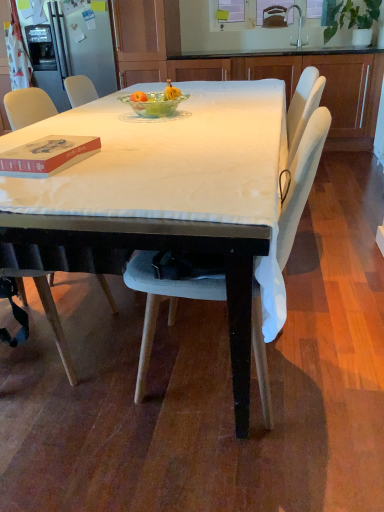
What is the approximate height of translucent glass bowl at center?

translucent glass bowl at center is 4.48 inches in height.

In order to face translucent glass bowl at center, should I rotate leftwards or rightwards?

Rotate left and turn 4.793 degrees.

The height and width of the screenshot is (512, 384). I want to click on translucent glass bowl at center, so click(155, 102).

Does white fabric-covered table at center turn towards matte red book at left?

No, white fabric-covered table at center is not facing towards matte red book at left.

Based on the photo, from the image's perspective, which one is positioned higher, white fabric-covered table at center or matte red book at left?

From the image's view, white fabric-covered table at center is above.

From a real-world perspective, is white fabric-covered table at center located higher than matte red book at left?

Actually, white fabric-covered table at center is physically below matte red book at left in the real world.

Which is more to the left, white fabric-covered table at center or matte red book at left?

Positioned to the left is matte red book at left.

Considering the points (363, 42) and (167, 68), which point is behind, point (363, 42) or point (167, 68)?

Positioned behind is point (167, 68).

Which object is further away from the camera, green leafy plant at upper right or white wood cabinets at center?

white wood cabinets at center is further from the camera.

Visually, is green leafy plant at upper right positioned to the left or to the right of white wood cabinets at center?

green leafy plant at upper right is to the right of white wood cabinets at center.

Are green leafy plant at upper right and white wood cabinets at center located far from each other?

They are positioned close to each other.

Between white fabric-covered table at center and green leafy plant at upper right, which one has larger width?

white fabric-covered table at center is wider.

From the image's perspective, which one is positioned lower, white fabric-covered table at center or green leafy plant at upper right?

white fabric-covered table at center is shown below in the image.

Which point is more forward, (134, 164) or (364, 36)?

Point (134, 164)

Does white fabric-covered table at center have a lesser height compared to green leafy plant at upper right?

Indeed, white fabric-covered table at center has a lesser height compared to green leafy plant at upper right.

Would you consider matte red book at left to be distant from light gray fabric chair at center?

→ matte red book at left is near light gray fabric chair at center, not far away.

In the image, is matte red book at left on the left side or the right side of light gray fabric chair at center?

In the image, matte red book at left appears on the left side of light gray fabric chair at center.

Considering the sizes of objects matte red book at left and light gray fabric chair at center in the image provided, who is shorter, matte red book at left or light gray fabric chair at center?

Standing shorter between the two is matte red book at left.

Can we say matte red book at left lies outside light gray fabric chair at center?

Yes, matte red book at left is outside of light gray fabric chair at center.

Is silver metallic faucet at upper center next to matte red book at left and touching it?

silver metallic faucet at upper center and matte red book at left are clearly separated.

Can you confirm if silver metallic faucet at upper center is taller than matte red book at left?

Correct, silver metallic faucet at upper center is much taller as matte red book at left.

From the image's perspective, which one is positioned lower, silver metallic faucet at upper center or matte red book at left?

matte red book at left.

Based on the photo, which of these two, silver metallic faucet at upper center or matte red book at left, is thinner?

silver metallic faucet at upper center.

Are matte red book at left and silver metallic faucet at upper center beside each other?

No, matte red book at left is not next to silver metallic faucet at upper center.

Measure the distance between matte red book at left and silver metallic faucet at upper center.

matte red book at left is 3.86 meters from silver metallic faucet at upper center.

Is matte red book at left at the left side of silver metallic faucet at upper center?

Correct, you'll find matte red book at left to the left of silver metallic faucet at upper center.

Considering the sizes of matte red book at left and white wood cabinets at center in the image, is matte red book at left wider or thinner than white wood cabinets at center?

Considering their sizes, matte red book at left looks slimmer than white wood cabinets at center.

You are a GUI agent. You are given a task and a screenshot of the screen. Output one action in this format:
    pyautogui.click(x=<x>, y=<y>)
    Task: Click on the cabinetry that is behind the matte red book at left
    This screenshot has height=512, width=384.
    Given the screenshot: What is the action you would take?
    pyautogui.click(x=297, y=82)

How far apart are matte red book at left and white wood cabinets at center?

matte red book at left is 10.08 feet away from white wood cabinets at center.

From a real-world perspective, who is located lower, matte red book at left or white wood cabinets at center?

white wood cabinets at center.

Locate an element on the screen. The height and width of the screenshot is (512, 384). desk that is under the matte red book at left (from a real-world perspective) is located at coordinates (172, 194).

Locate an element on the screen. houseplant that appears on the right of white wood cabinets at center is located at coordinates (353, 20).

Based on their spatial positions, is light gray fabric chair at center or translucent glass bowl at center closer to silver metallic faucet at upper center?

translucent glass bowl at center lies closer to silver metallic faucet at upper center than the other object.

Considering their positions, is matte red book at left positioned closer to white fabric-covered table at center than green leafy plant at upper right?

matte red book at left is closer to white fabric-covered table at center.

Estimate the real-world distances between objects in this image. Which object is further from silver metallic faucet at upper center, translucent glass bowl at center or green leafy plant at upper right?

translucent glass bowl at center is positioned further to the anchor silver metallic faucet at upper center.

Consider the image. Looking at the image, which one is located further to green leafy plant at upper right, matte red book at left or light gray fabric chair at center?

matte red book at left lies further to green leafy plant at upper right than the other object.

From the image, which object appears to be farther from matte red book at left, silver metallic faucet at upper center or light gray fabric chair at center?

Based on the image, silver metallic faucet at upper center appears to be further to matte red book at left.

Considering their positions, is translucent glass bowl at center positioned closer to white wood cabinets at center than white fabric-covered table at center?

translucent glass bowl at center.

When comparing their distances from matte red book at left, does white wood cabinets at center or light gray fabric chair at center seem closer?

light gray fabric chair at center lies closer to matte red book at left than the other object.

Looking at the image, which one is located further to white fabric-covered table at center, matte red book at left or light gray fabric chair at center?

The object further to white fabric-covered table at center is light gray fabric chair at center.

The image size is (384, 512). In order to click on houseplant between matte red book at left and silver metallic faucet at upper center in the front-back direction in this screenshot , I will do `click(353, 20)`.

This screenshot has height=512, width=384. Identify the location of fruit dish positioned between matte red book at left and silver metallic faucet at upper center from near to far. (155, 102).

This screenshot has width=384, height=512. I want to click on cabinetry between matte red book at left and silver metallic faucet at upper center along the z-axis, so click(297, 82).

Locate an element on the screen. Image resolution: width=384 pixels, height=512 pixels. box positioned between light gray fabric chair at center and white wood cabinets at center from near to far is located at coordinates (47, 156).